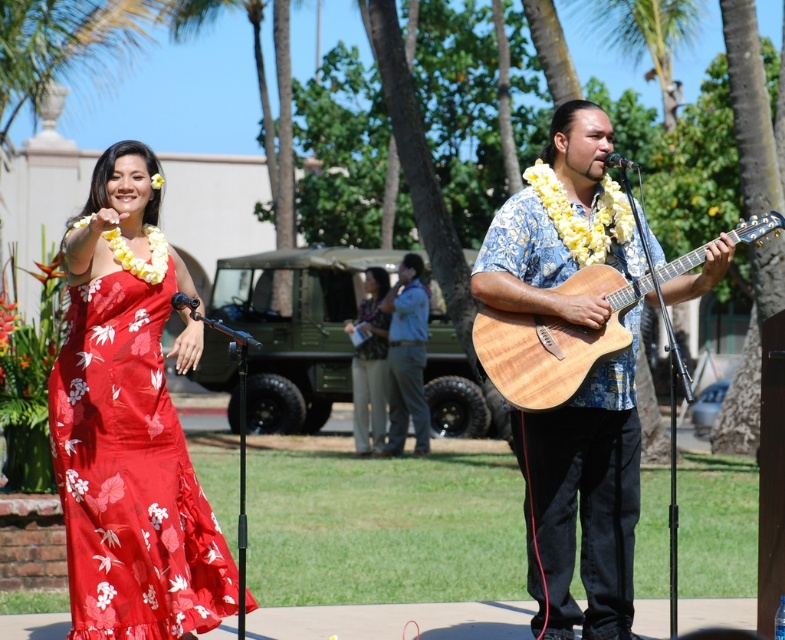
Find the location of a particular element. green matte jeep at center is located at coordinates (294, 330).

At what (x,y) coordinates should I click in order to perform the action: click on green matte jeep at center. Please return your answer as a coordinate pair (x, y). Looking at the image, I should click on (294, 330).

You are a GUI agent. You are given a task and a screenshot of the screen. Output one action in this format:
    pyautogui.click(x=<x>, y=<y>)
    Task: Click on the green matte jeep at center
    Image resolution: width=785 pixels, height=640 pixels.
    Given the screenshot: What is the action you would take?
    pyautogui.click(x=294, y=330)

Can you confirm if matte floral fabric dress at left is positioned below matte khaki pants at center?

Incorrect, matte floral fabric dress at left is not positioned below matte khaki pants at center.

Does matte floral fabric dress at left have a larger size compared to matte khaki pants at center?

Incorrect, matte floral fabric dress at left is not larger than matte khaki pants at center.

Is point (71, 538) positioned after point (369, 310)?

No, (71, 538) is closer to viewer.

The width and height of the screenshot is (785, 640). I want to click on matte floral fabric dress at left, so click(130, 474).

In the scene shown: Does wooden acoustic guitar at center have a larger size compared to natural wood guitar at center?

Yes.

Between wooden acoustic guitar at center and natural wood guitar at center, which one appears on the right side from the viewer's perspective?

natural wood guitar at center is more to the right.

Measure the distance between wooden acoustic guitar at center and camera.

wooden acoustic guitar at center is 6.91 meters from camera.

This screenshot has height=640, width=785. What are the coordinates of `wooden acoustic guitar at center` in the screenshot? It's located at (583, 502).